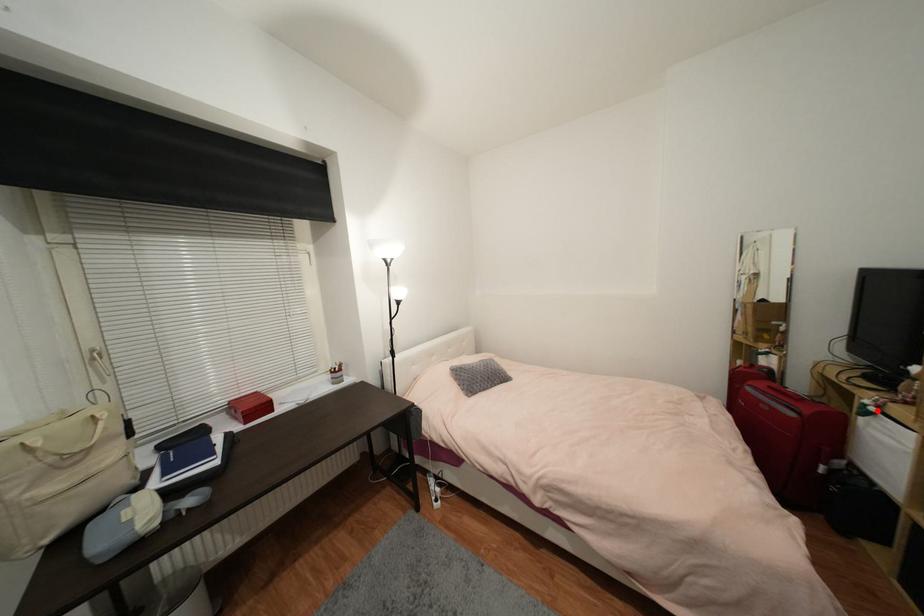
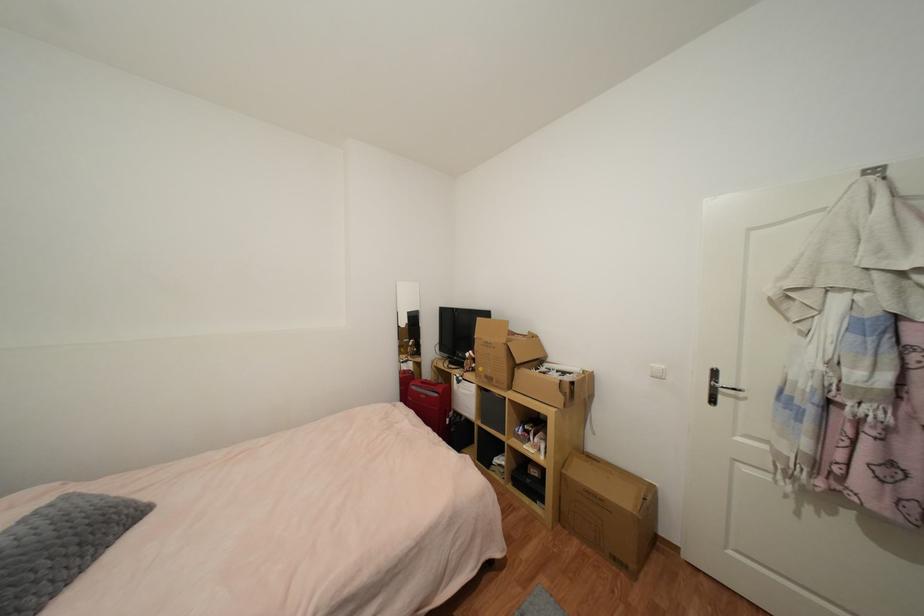
Locate, in the second image, the point that corresponds to the highlighted location in the first image.

(465, 379)